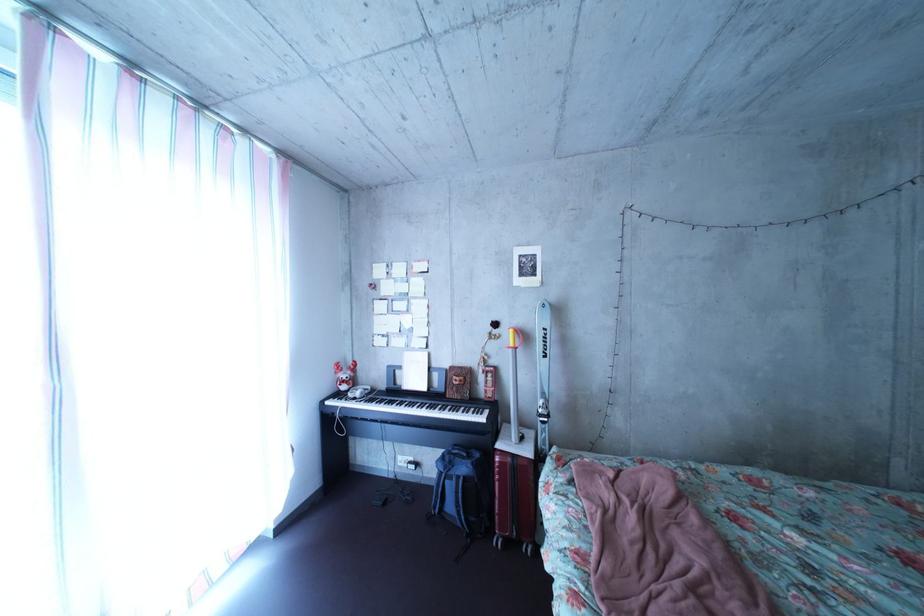
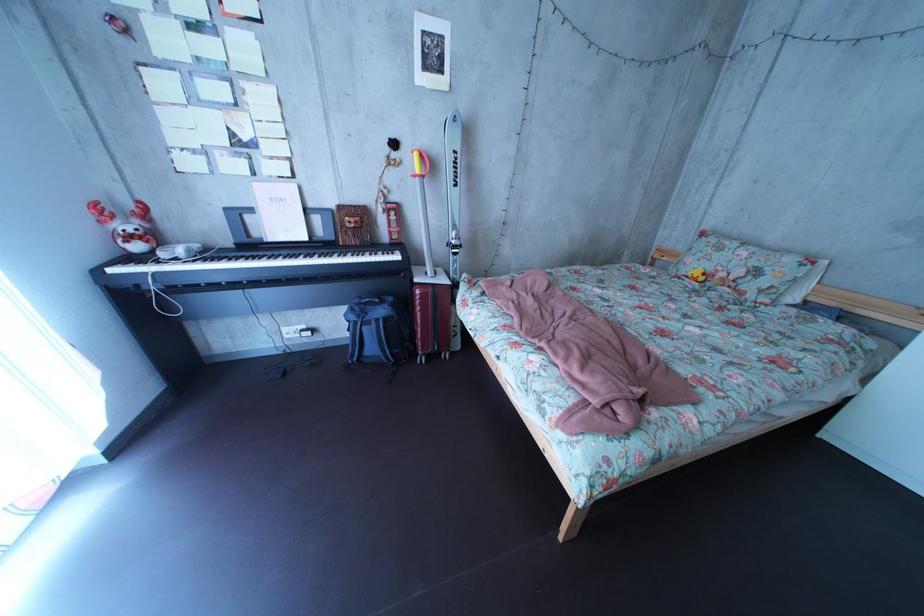
Find the pixel in the second image that matches point 479,477 in the first image.

(395, 320)